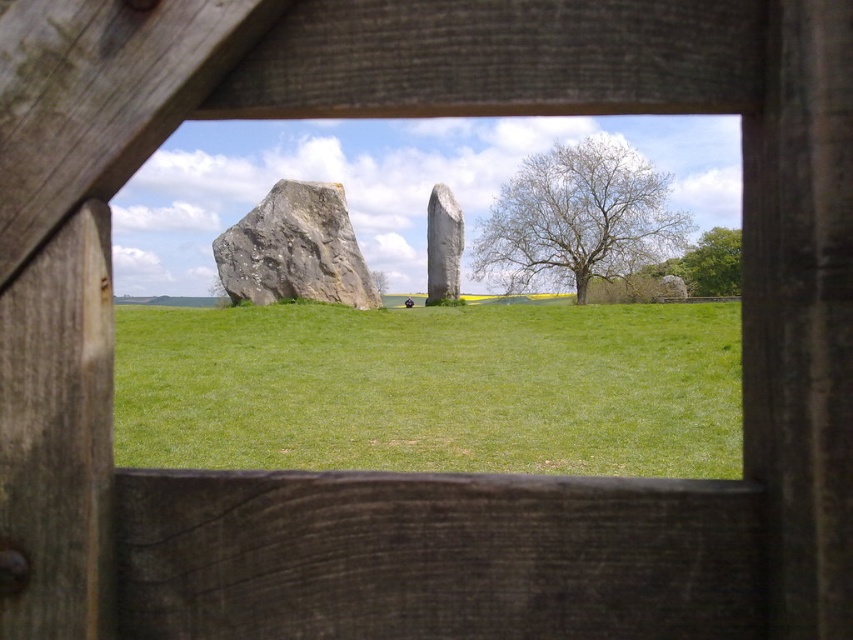
You are standing in front of a wooden frame and want to take a photo of both the transparent glass window at center and the green leafy tree at upper right. Which object should you focus on first to ensure both are in focus?

You should focus on the transparent glass window at center first because it is closer to you than the green leafy tree at upper right. By focusing on the closer object, the tree will still be in focus due to the depth of field extending backward.

You are a painter standing at the wooden frame and want to paint the green grass at center. Since the transparent glass window at center is in the way, can you paint around it?

The transparent glass window at center is taller than green grass at center, so you can paint around it as the window is higher up and doesn